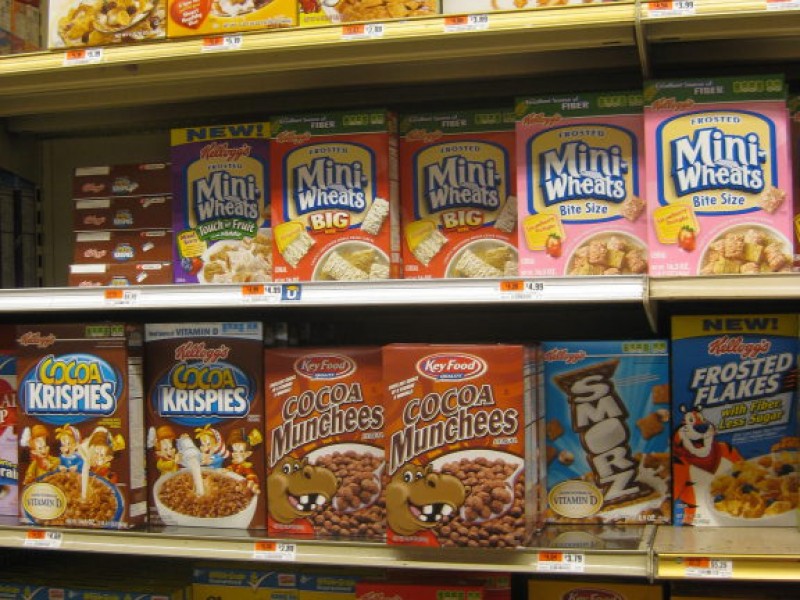
Locate an element on the screen. This screenshot has height=600, width=800. cereal boxes on the second shelf is located at coordinates (97, 180), (102, 208), (102, 240), (104, 271), (213, 196), (318, 189), (450, 210), (608, 205), (706, 190).